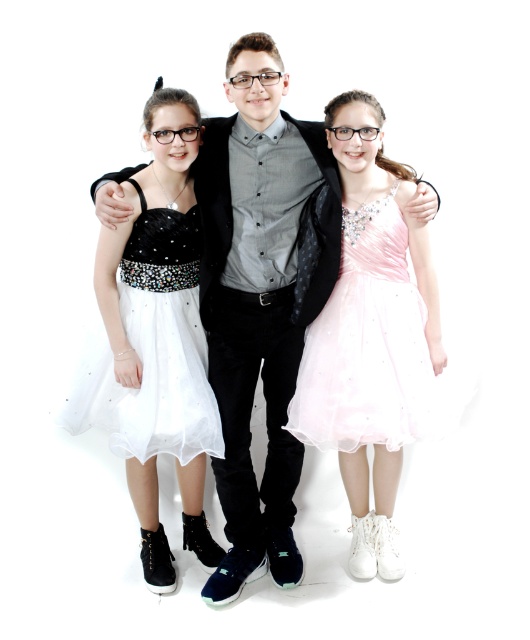
Consider the image. Can you confirm if matte black shirt at center is taller than pink satin dress at center?

Yes, matte black shirt at center is taller than pink satin dress at center.

Does point (287, 264) come in front of point (360, 140)?

No, (287, 264) is further to viewer.

Who is more distant from viewer, (x=328, y=179) or (x=401, y=230)?

The point (x=401, y=230) is more distant.

I want to click on matte black shirt at center, so click(260, 298).

Identify the location of matte black shirt at center. The width and height of the screenshot is (530, 640). (260, 298).

Can you confirm if matte black shirt at center is thinner than white tulle dress at left?

Incorrect, matte black shirt at center's width is not less than white tulle dress at left's.

In order to click on matte black shirt at center in this screenshot , I will do `click(260, 298)`.

Who is higher up, pink satin dress at center or white tulle dress at left?

white tulle dress at left is above.

Who is more forward, (348, 362) or (160, 321)?

Point (348, 362)

You are a GUI agent. You are given a task and a screenshot of the screen. Output one action in this format:
    pyautogui.click(x=<x>, y=<y>)
    Task: Click on the pink satin dress at center
    The height and width of the screenshot is (640, 530).
    Given the screenshot: What is the action you would take?
    pyautogui.click(x=372, y=336)